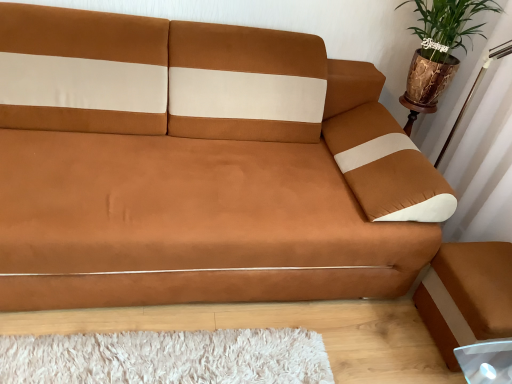
Question: Based on their positions, is suede brown couch at center located to the left or right of green leafy plant in brown pot at upper right?

Choices:
 (A) right
 (B) left

Answer: (B)

Question: Do you think suede brown couch at center is within green leafy plant in brown pot at upper right, or outside of it?

Choices:
 (A) outside
 (B) inside

Answer: (A)

Question: Which of these objects is positioned closest to the brown leather footrest at lower right?

Choices:
 (A) suede brown couch at center
 (B) green leafy plant in brown pot at upper right

Answer: (A)

Question: Considering the real-world distances, which object is farthest from the suede brown couch at center?

Choices:
 (A) brown leather footrest at lower right
 (B) green leafy plant in brown pot at upper right

Answer: (B)